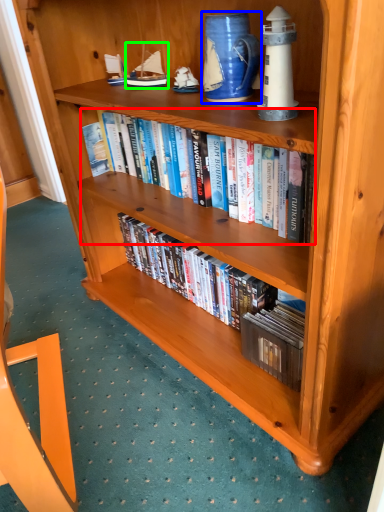
Question: Estimate the real-world distances between objects in this image. Which object is farther from book (highlighted by a red box), pitcher (highlighted by a blue box) or toy (highlighted by a green box)?

Choices:
 (A) pitcher
 (B) toy

Answer: (B)